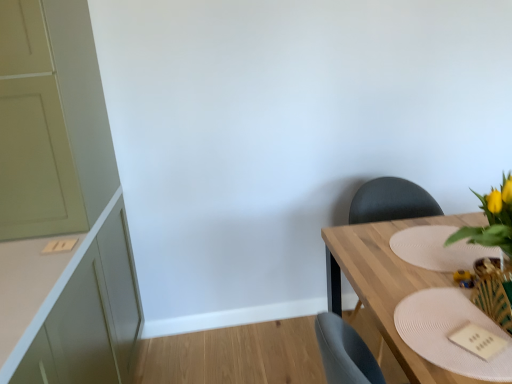
Question: From the image's perspective, does matte black chair at right appear higher than white textured placemat at lower right, arranged as the first plate when ordered from the bottom?

Choices:
 (A) yes
 (B) no

Answer: (A)

Question: Can you confirm if matte black chair at right is positioned to the left of white textured placemat at lower right, marked as the second plate in a back-to-front arrangement?

Choices:
 (A) yes
 (B) no

Answer: (B)

Question: Does matte black chair at right come in front of white textured placemat at lower right, which ranks as the 2th plate in top-to-bottom order?

Choices:
 (A) yes
 (B) no

Answer: (B)

Question: Is matte black chair at right taller than white textured placemat at lower right, marked as the second plate in a back-to-front arrangement?

Choices:
 (A) yes
 (B) no

Answer: (A)

Question: Would you say white textured placemat at lower right, arranged as the first plate when ordered from the bottom, is part of matte black chair at right's contents?

Choices:
 (A) yes
 (B) no

Answer: (B)

Question: From the image's perspective, is yellow artificial flowers at right above or below wooden textured vase at lower right?

Choices:
 (A) below
 (B) above

Answer: (B)

Question: Is point (492, 309) positioned closer to the camera than point (505, 286)?

Choices:
 (A) closer
 (B) farther

Answer: (A)

Question: Would you say yellow artificial flowers at right is to the left or to the right of wooden textured vase at lower right in the picture?

Choices:
 (A) right
 (B) left

Answer: (A)

Question: From a real-world perspective, is yellow artificial flowers at right physically located above or below wooden textured vase at lower right?

Choices:
 (A) above
 (B) below

Answer: (A)

Question: In terms of height, does wooden table at right look taller or shorter compared to wooden textured vase at lower right?

Choices:
 (A) tall
 (B) short

Answer: (A)

Question: Is point (378, 283) positioned closer to the camera than point (496, 271)?

Choices:
 (A) farther
 (B) closer

Answer: (A)

Question: From a real-world perspective, is wooden table at right physically located above or below wooden textured vase at lower right?

Choices:
 (A) below
 (B) above

Answer: (A)

Question: Looking at the image, does wooden table at right seem bigger or smaller compared to wooden textured vase at lower right?

Choices:
 (A) big
 (B) small

Answer: (A)

Question: In terms of height, does yellow artificial flowers at right look taller or shorter compared to matte black chair at right?

Choices:
 (A) short
 (B) tall

Answer: (B)

Question: Considering the positions of point (496, 304) and point (412, 205), is point (496, 304) closer or farther from the camera than point (412, 205)?

Choices:
 (A) farther
 (B) closer

Answer: (B)